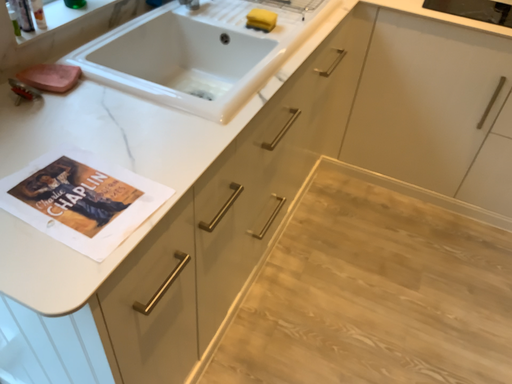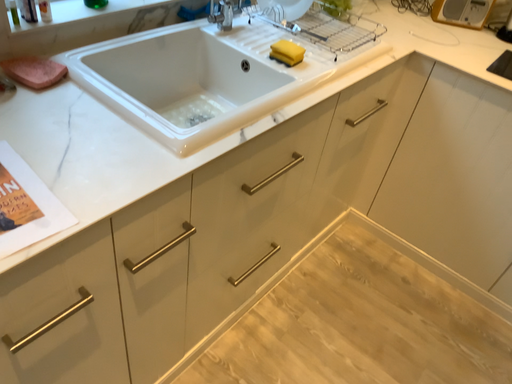
Question: How did the camera likely rotate when shooting the video?

Choices:
 (A) rotated left
 (B) rotated right

Answer: (A)